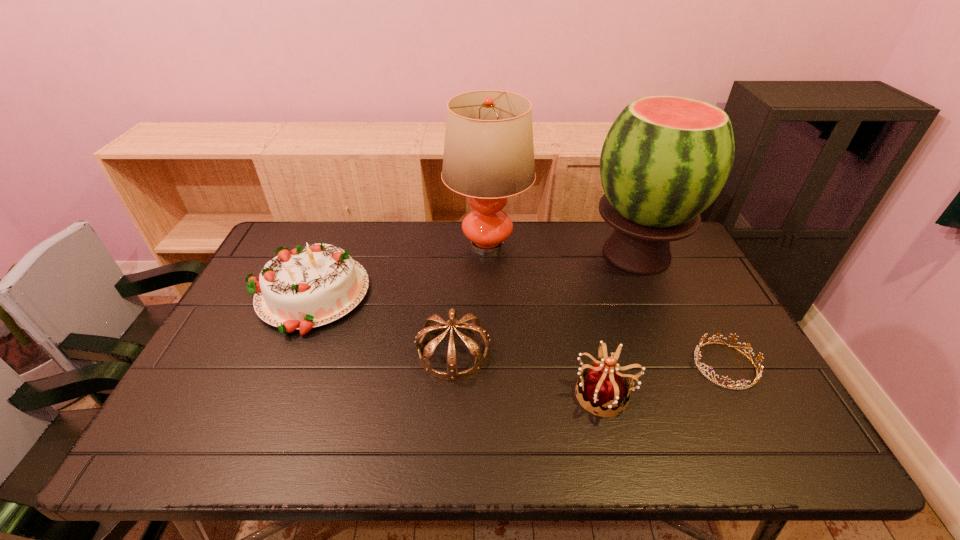
Locate an element on the screen. The width and height of the screenshot is (960, 540). vacant position at the near edge of the desktop is located at coordinates (346, 446).

Locate an element on the screen. The width and height of the screenshot is (960, 540). free space at the left edge of the desktop is located at coordinates (260, 354).

I want to click on vacant space at the right edge, so click(x=687, y=329).

Identify the location of free region at the near right corner of the desktop. This screenshot has height=540, width=960. (752, 455).

Locate an element on the screen. This screenshot has width=960, height=540. vacant point located between the tallest tiara and the lamp is located at coordinates (546, 320).

Where is `vacant space in between the shortest object and the lamp`? The width and height of the screenshot is (960, 540). vacant space in between the shortest object and the lamp is located at coordinates (606, 305).

Locate an element on the screen. The width and height of the screenshot is (960, 540). vacant point located between the fifth tallest object and the fourth shortest object is located at coordinates (379, 323).

Identify the location of vacant area that lies between the watermelon and the leftmost tiara. The image size is (960, 540). [545, 303].

At what (x,y) coordinates should I click in order to perform the action: click on free space between the rightmost tiara and the watermelon. Please return your answer as a coordinate pair (x, y). Looking at the image, I should click on (681, 309).

Image resolution: width=960 pixels, height=540 pixels. Find the location of `vacant space that is in between the second tiara from left to right and the leftmost tiara`. vacant space that is in between the second tiara from left to right and the leftmost tiara is located at coordinates (529, 373).